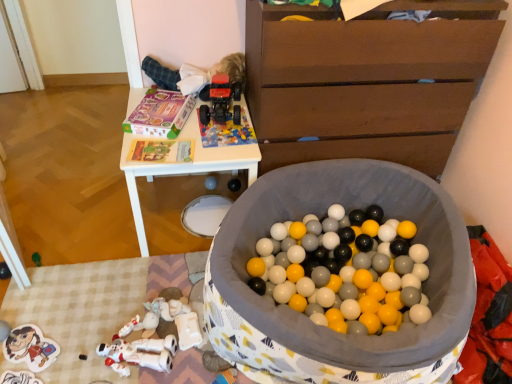
Question: Should I look upward or downward to see soft fabric ball pit at center, which is the sixth toy in left-to-right order?

Choices:
 (A) up
 (B) down

Answer: (B)

Question: Does rubberized red toy truck at upper center, which appears as the third toy when viewed from the right, appear on the right side of matte plastic speaker at center, placed as the third toy when sorted from left to right?

Choices:
 (A) no
 (B) yes

Answer: (B)

Question: Is rubberized red toy truck at upper center, which appears as the third toy when viewed from the right, aimed at matte plastic speaker at center, positioned as the fourth toy in right-to-left order?

Choices:
 (A) no
 (B) yes

Answer: (A)

Question: Can you confirm if rubberized red toy truck at upper center, which appears as the third toy when viewed from the right, is thinner than matte plastic speaker at center, positioned as the fourth toy in right-to-left order?

Choices:
 (A) no
 (B) yes

Answer: (A)

Question: Is rubberized red toy truck at upper center, which is the 4th toy from left to right, placed right next to matte plastic speaker at center, positioned as the fourth toy in right-to-left order?

Choices:
 (A) yes
 (B) no

Answer: (B)

Question: Considering the relative sizes of rubberized red toy truck at upper center, which is the 4th toy from left to right, and matte plastic speaker at center, positioned as the fourth toy in right-to-left order, in the image provided, is rubberized red toy truck at upper center, which is the 4th toy from left to right, wider than matte plastic speaker at center, positioned as the fourth toy in right-to-left order,?

Choices:
 (A) no
 (B) yes

Answer: (B)

Question: Would you say rubberized red toy truck at upper center, which appears as the third toy when viewed from the right, is outside matte plastic speaker at center, positioned as the fourth toy in right-to-left order?

Choices:
 (A) yes
 (B) no

Answer: (A)

Question: Does soft fabric ball pit at center, acting as the first toy starting from the right, have a smaller size compared to rubberized red toy truck at upper center, which appears as the third toy when viewed from the right?

Choices:
 (A) yes
 (B) no

Answer: (B)

Question: Is rubberized red toy truck at upper center, which appears as the third toy when viewed from the right, located within soft fabric ball pit at center, which is the sixth toy in left-to-right order?

Choices:
 (A) yes
 (B) no

Answer: (B)

Question: Considering the relative sizes of soft fabric ball pit at center, which is the sixth toy in left-to-right order, and rubberized red toy truck at upper center, which is the 4th toy from left to right, in the image provided, is soft fabric ball pit at center, which is the sixth toy in left-to-right order, taller than rubberized red toy truck at upper center, which is the 4th toy from left to right,?

Choices:
 (A) no
 (B) yes

Answer: (B)

Question: From a real-world perspective, is soft fabric ball pit at center, which is the sixth toy in left-to-right order, located higher than rubberized red toy truck at upper center, which is the 4th toy from left to right?

Choices:
 (A) no
 (B) yes

Answer: (A)

Question: Does soft fabric ball pit at center, acting as the first toy starting from the right, turn towards rubberized red toy truck at upper center, which appears as the third toy when viewed from the right?

Choices:
 (A) yes
 (B) no

Answer: (B)

Question: From the image's perspective, is soft fabric ball pit at center, acting as the first toy starting from the right, over rubberized red toy truck at upper center, which appears as the third toy when viewed from the right?

Choices:
 (A) no
 (B) yes

Answer: (A)

Question: Does matte black speaker at center, acting as the 5th toy starting from the left, have a lesser height compared to brown wooden chest of drawers at upper right?

Choices:
 (A) yes
 (B) no

Answer: (A)